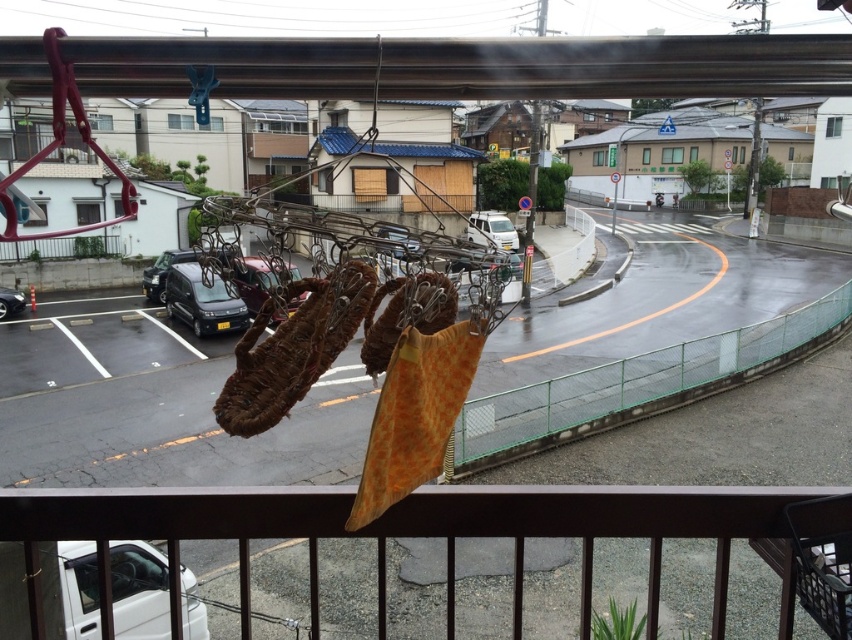
Does white matte van at center have a greater height compared to shiny black sedan at left?

No, white matte van at center is not taller than shiny black sedan at left.

Does white matte van at center have a lesser height compared to shiny black sedan at left?

Yes, white matte van at center is shorter than shiny black sedan at left.

Find the location of a particular element. white matte van at center is located at coordinates (492, 228).

This screenshot has height=640, width=852. Identify the location of white matte van at center. (492, 228).

In the scene shown: Between white matte car at lower left and white matte van at center, which one has less height?

Standing shorter between the two is white matte van at center.

Can you confirm if white matte car at lower left is wider than white matte van at center?

Correct, the width of white matte car at lower left exceeds that of white matte van at center.

Does point (96, 611) come closer to viewer compared to point (484, 241)?

Yes.

Identify the location of white matte car at lower left. This screenshot has height=640, width=852. (139, 589).

Is brown wooden rail at lower center below shiny silver car at center?

Correct, brown wooden rail at lower center is located below shiny silver car at center.

Does brown wooden rail at lower center have a lesser height compared to shiny silver car at center?

No, brown wooden rail at lower center is not shorter than shiny silver car at center.

Between point (563, 499) and point (395, 241), which one is positioned in front?

Point (395, 241) is more forward.

Image resolution: width=852 pixels, height=640 pixels. Identify the location of brown wooden rail at lower center. (x=409, y=531).